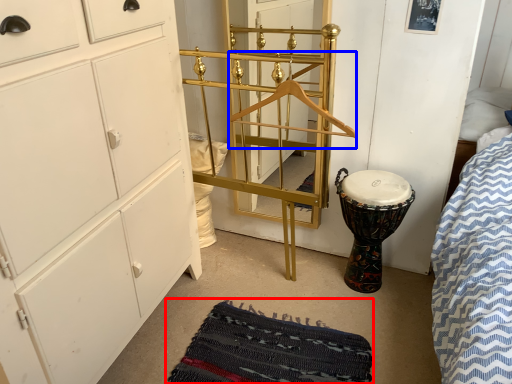
Question: Which object is closer to the camera taking this photo, mat (highlighted by a red box) or hanger (highlighted by a blue box)?

Choices:
 (A) mat
 (B) hanger

Answer: (A)